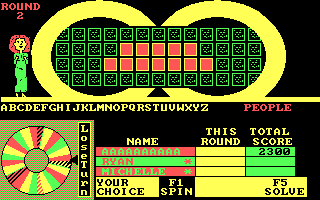
You are a GUI agent. You are given a task and a screenshot of the screen. Output one action in this format:
    pyautogui.click(x=<x>, y=<y>)
    Task: Click on the play board
    
    Given the screenshot: What is the action you would take?
    pyautogui.click(x=191, y=57)